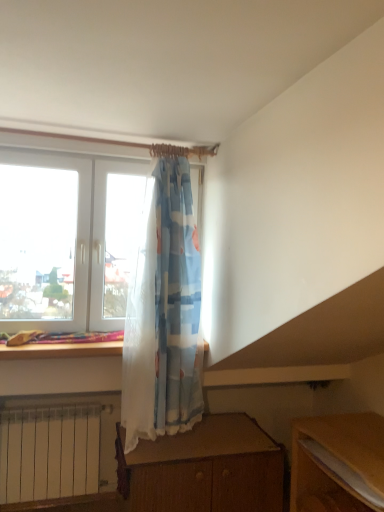
Question: From the image's perspective, is wooden desk at lower center on wooden table at lower right?

Choices:
 (A) yes
 (B) no

Answer: (B)

Question: Is wooden desk at lower center wider than wooden table at lower right?

Choices:
 (A) yes
 (B) no

Answer: (A)

Question: Is wooden desk at lower center closer to the viewer compared to wooden table at lower right?

Choices:
 (A) yes
 (B) no

Answer: (B)

Question: Considering the relative sizes of wooden desk at lower center and wooden table at lower right in the image provided, is wooden desk at lower center shorter than wooden table at lower right?

Choices:
 (A) yes
 (B) no

Answer: (B)

Question: Does wooden desk at lower center appear on the left side of wooden table at lower right?

Choices:
 (A) no
 (B) yes

Answer: (B)

Question: Are wooden desk at lower center and wooden table at lower right beside each other?

Choices:
 (A) yes
 (B) no

Answer: (B)

Question: Is wooden table at lower right outside wooden desk at lower center?

Choices:
 (A) yes
 (B) no

Answer: (A)

Question: Can you confirm if wooden table at lower right is bigger than wooden desk at lower center?

Choices:
 (A) no
 (B) yes

Answer: (A)

Question: From the image's perspective, is wooden table at lower right under wooden desk at lower center?

Choices:
 (A) yes
 (B) no

Answer: (B)

Question: From a real-world perspective, is wooden table at lower right on top of wooden desk at lower center?

Choices:
 (A) no
 (B) yes

Answer: (B)

Question: Considering the relative sizes of wooden table at lower right and wooden desk at lower center in the image provided, is wooden table at lower right wider than wooden desk at lower center?

Choices:
 (A) no
 (B) yes

Answer: (A)

Question: Is wooden table at lower right surrounding wooden desk at lower center?

Choices:
 (A) no
 (B) yes

Answer: (A)

Question: Relative to wooden desk at lower center, is wooden table at lower right in front or behind?

Choices:
 (A) front
 (B) behind

Answer: (A)